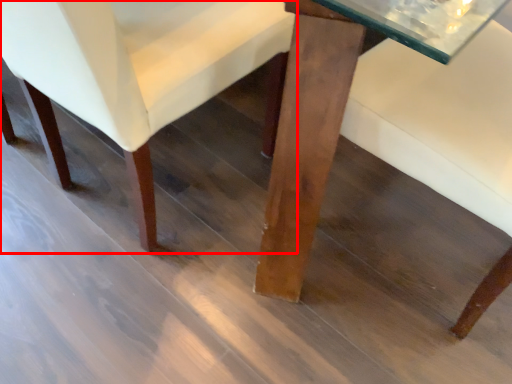
Question: Considering the relative positions of chair (annotated by the red box) and table in the image provided, where is chair (annotated by the red box) located with respect to the staircase?

Choices:
 (A) right
 (B) left

Answer: (B)